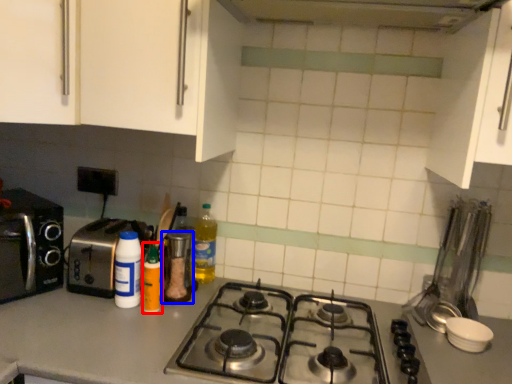
Question: Which of the following is the closest to the observer, bottle (highlighted by a red box) or kitchen appliance (highlighted by a blue box)?

Choices:
 (A) bottle
 (B) kitchen appliance

Answer: (A)